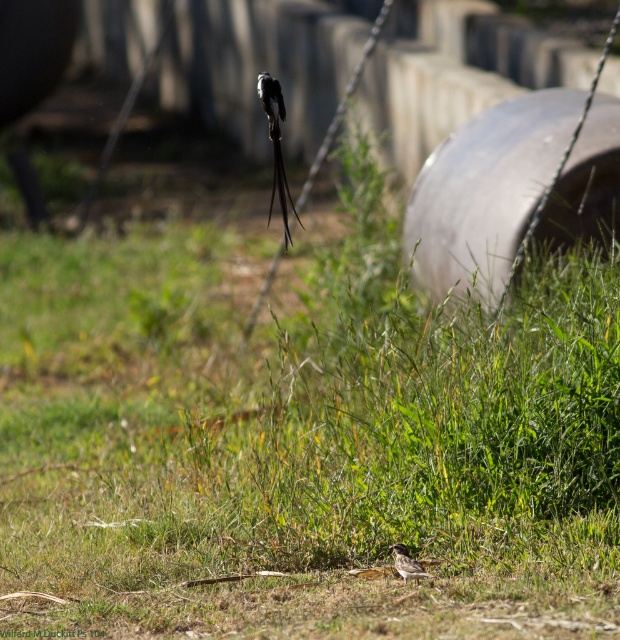
Question: Can you confirm if silvery metallic bird at center is positioned to the left of brown speckled bird at center?

Choices:
 (A) yes
 (B) no

Answer: (A)

Question: Can you confirm if silvery metallic bird at center is wider than brown speckled bird at center?

Choices:
 (A) yes
 (B) no

Answer: (A)

Question: Is silvery metallic bird at center closer to camera compared to brown speckled bird at center?

Choices:
 (A) yes
 (B) no

Answer: (B)

Question: Among these objects, which one is nearest to the camera?

Choices:
 (A) silvery metallic bird at center
 (B) brown speckled bird at center

Answer: (B)

Question: Which object is farther from the camera taking this photo?

Choices:
 (A) silvery metallic bird at center
 (B) brown speckled bird at center

Answer: (A)